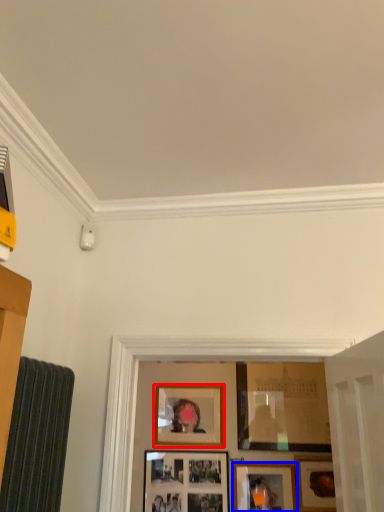
Question: Which object is further to the camera taking this photo, picture frame (highlighted by a red box) or picture frame (highlighted by a blue box)?

Choices:
 (A) picture frame
 (B) picture frame

Answer: (A)